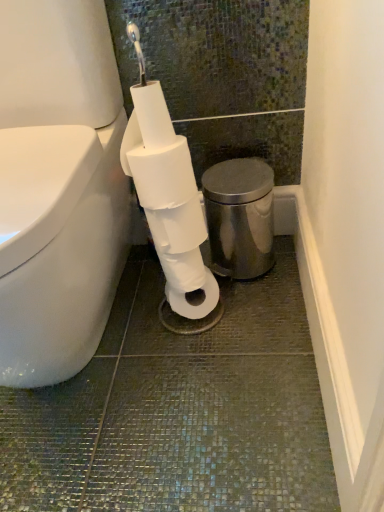
Question: Does polished stainless steel bidet at right lie in front of white matte toilet paper at center, which is counted as the second toilet paper, starting from the top?

Choices:
 (A) yes
 (B) no

Answer: (B)

Question: Can you confirm if polished stainless steel bidet at right is taller than white matte toilet paper at center, which is counted as the second toilet paper, starting from the top?

Choices:
 (A) yes
 (B) no

Answer: (A)

Question: From the image's perspective, is polished stainless steel bidet at right above white matte toilet paper at center, the first toilet paper in the bottom-to-top sequence?

Choices:
 (A) no
 (B) yes

Answer: (B)

Question: Is polished stainless steel bidet at right to the right of white matte toilet paper at center, the first toilet paper in the bottom-to-top sequence, from the viewer's perspective?

Choices:
 (A) yes
 (B) no

Answer: (A)

Question: Considering the relative sizes of polished stainless steel bidet at right and white matte toilet paper at center, which is counted as the second toilet paper, starting from the top, in the image provided, is polished stainless steel bidet at right shorter than white matte toilet paper at center, which is counted as the second toilet paper, starting from the top,?

Choices:
 (A) no
 (B) yes

Answer: (A)

Question: Is white matte toilet paper at center, which is counted as the second toilet paper, starting from the top, inside the boundaries of polished stainless steel bidet at right, or outside?

Choices:
 (A) inside
 (B) outside

Answer: (B)

Question: From a real-world perspective, is white matte toilet paper at center, which is counted as the second toilet paper, starting from the top, positioned above or below polished stainless steel bidet at right?

Choices:
 (A) above
 (B) below

Answer: (A)

Question: Is white matte toilet paper at center, which is counted as the second toilet paper, starting from the top, wider or thinner than polished stainless steel bidet at right?

Choices:
 (A) wide
 (B) thin

Answer: (B)

Question: Is point (185, 254) positioned closer to the camera than point (226, 225)?

Choices:
 (A) closer
 (B) farther

Answer: (A)

Question: Based on their positions, is white matte toilet paper at center, the 2th toilet paper in the bottom-to-top sequence, located to the left or right of polished stainless steel bidet at right?

Choices:
 (A) left
 (B) right

Answer: (A)

Question: Is white matte toilet paper at center, positioned as the 1th toilet paper in top-to-bottom order, wider or thinner than polished stainless steel bidet at right?

Choices:
 (A) wide
 (B) thin

Answer: (B)

Question: From the image's perspective, is white matte toilet paper at center, the 2th toilet paper in the bottom-to-top sequence, above or below polished stainless steel bidet at right?

Choices:
 (A) below
 (B) above

Answer: (B)

Question: Is white matte toilet paper at center, the 2th toilet paper in the bottom-to-top sequence, in front of or behind polished stainless steel bidet at right in the image?

Choices:
 (A) front
 (B) behind

Answer: (A)

Question: Is polished stainless steel bidet at right wider or thinner than white matte toilet paper at center, the first toilet paper in the bottom-to-top sequence?

Choices:
 (A) thin
 (B) wide

Answer: (B)

Question: From the image's perspective, relative to white matte toilet paper at center, which is counted as the second toilet paper, starting from the top, is polished stainless steel bidet at right above or below?

Choices:
 (A) below
 (B) above

Answer: (B)